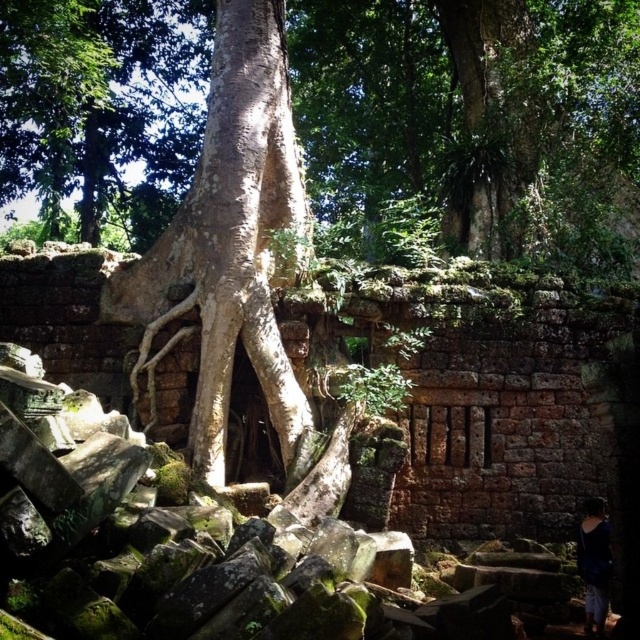
Question: Among these objects, which one is nearest to the camera?

Choices:
 (A) dark blue fabric at lower right
 (B) white rough tree trunk at center

Answer: (A)

Question: Is smooth bark tree at center to the left of dark blue fabric at lower right from the viewer's perspective?

Choices:
 (A) yes
 (B) no

Answer: (A)

Question: Does white rough tree trunk at center appear on the right side of dark blue fabric at lower right?

Choices:
 (A) yes
 (B) no

Answer: (B)

Question: Estimate the real-world distances between objects in this image. Which object is farther from the smooth bark tree at center?

Choices:
 (A) dark blue fabric at lower right
 (B) white rough tree trunk at center

Answer: (A)

Question: Which of these objects is positioned farthest from the white rough tree trunk at center?

Choices:
 (A) smooth bark tree at center
 (B) dark blue fabric at lower right

Answer: (A)

Question: Can you confirm if smooth bark tree at center is positioned to the right of dark blue fabric at lower right?

Choices:
 (A) yes
 (B) no

Answer: (B)